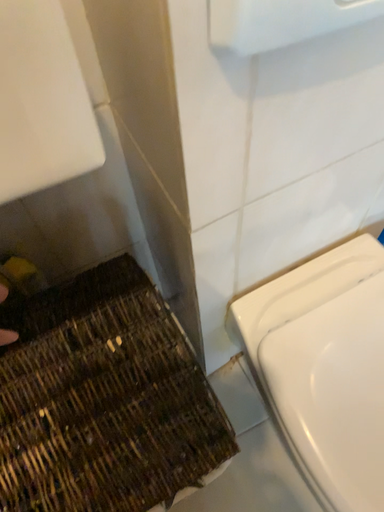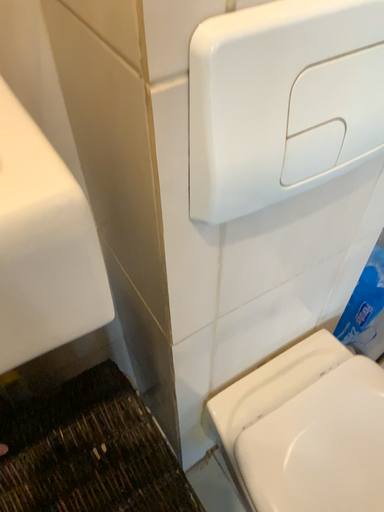
Question: How did the camera likely rotate when shooting the video?

Choices:
 (A) rotated upward
 (B) rotated downward

Answer: (A)